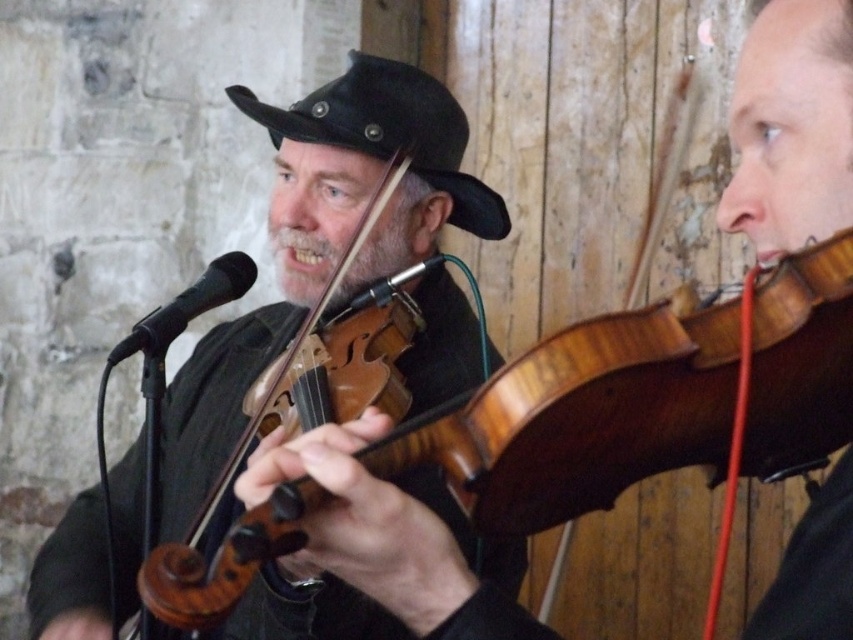
You are a photographer setting up for a shoot in the scene described. You need to position a light source so that it illuminates both the wooden violin at center and the black leather hat at center. Given their positions, where should you place the light relative to these objects?

The wooden violin at center is located below the black leather hat at center. To illuminate both effectively, position the light source above the black leather hat at center so that the light naturally falls downward onto both objects.